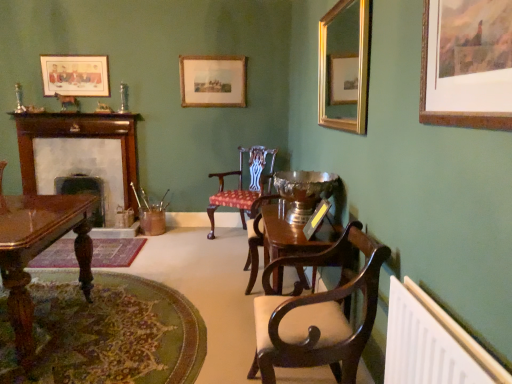
You are a GUI agent. You are given a task and a screenshot of the screen. Output one action in this format:
    pyautogui.click(x=<x>, y=<y>)
    Task: Click on the free point above wooden picture frame at upper center, the 3th picture frame positioned from the right (from a real-world perspective)
    
    Given the screenshot: What is the action you would take?
    pyautogui.click(x=212, y=56)